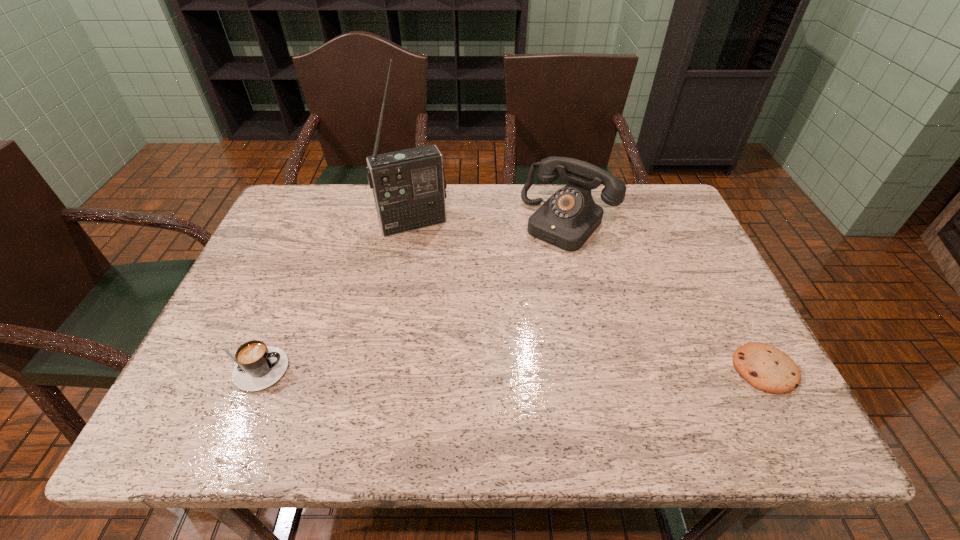
Locate an element on the screen. The width and height of the screenshot is (960, 540). vacant space on the desktop that is between the third tallest object and the rightmost object and is positioned on the dial of the telephone is located at coordinates (432, 369).

Locate an element on the screen. This screenshot has width=960, height=540. free space on the desktop that is between the leftmost object and the cookie and is positioned on the display of the second object from left to right is located at coordinates (480, 369).